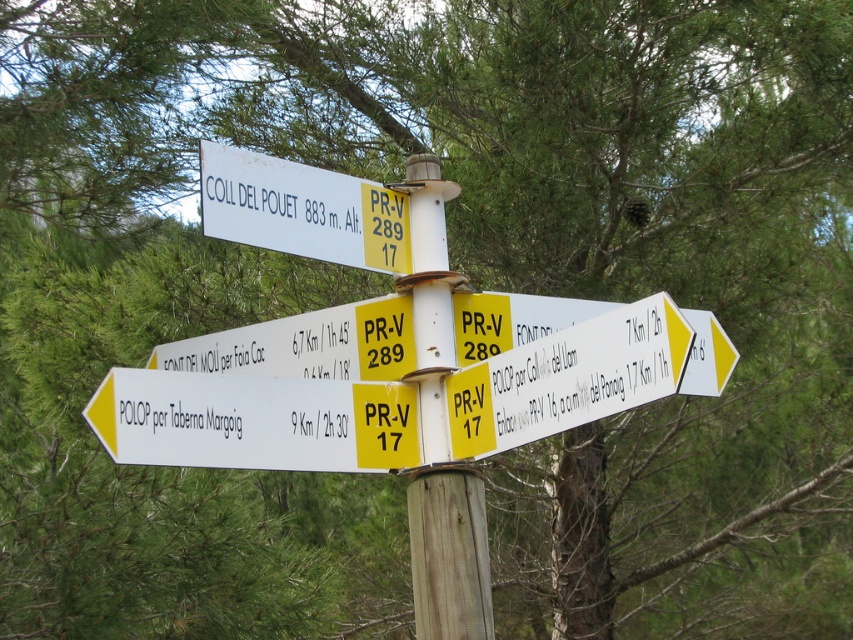
Does white plastic sign at lower left appear on the right side of yellow plastic sign at center?

Incorrect, white plastic sign at lower left is not on the right side of yellow plastic sign at center.

Between white plastic sign at lower left and yellow plastic sign at center, which one is positioned higher?

Positioned higher is yellow plastic sign at center.

Does point (415, 449) come behind point (637, 397)?

Yes, point (415, 449) is farther from viewer.

Identify the location of white plastic sign at lower left. (254, 420).

Is point (372, 419) less distant than point (329, 230)?

No, it is behind (329, 230).

Locate an element on the screen. The image size is (853, 640). white plastic sign at lower left is located at coordinates (254, 420).

Which is below, white plastic sign at lower left or white wooden post at center?

white plastic sign at lower left is lower down.

This screenshot has height=640, width=853. In order to click on white plastic sign at lower left in this screenshot , I will do (254, 420).

What are the coordinates of `white plastic sign at lower left` in the screenshot? It's located at (254, 420).